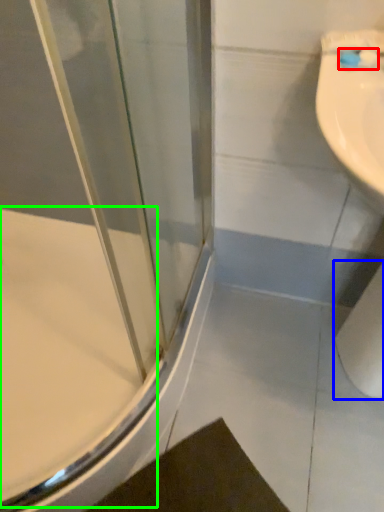
Question: Estimate the real-world distances between objects in this image. Which object is closer to toothbrush (highlighted by a red box), toilet paper (highlighted by a blue box) or bath (highlighted by a green box)?

Choices:
 (A) toilet paper
 (B) bath

Answer: (A)